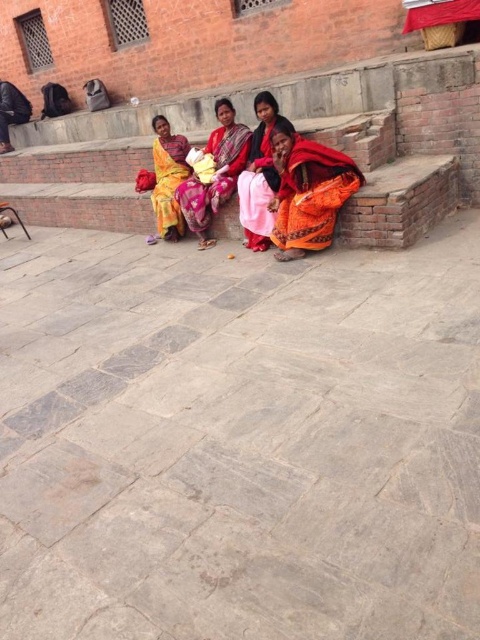
You are a photographer standing at the bottom of the stone steps where the women are sitting. You want to take a photo of the orange fabric sari at center and ensure that the entire sari is visible in the frame. The camera you are using has a minimum focus distance of 5 meters. Will you be able to capture the sari clearly?

The orange fabric sari at center is 5.71 meters away from you. Since the minimum focus distance of your camera is 5 meters, you can capture the orange fabric sari at center clearly as you are beyond the minimum required distance.

You are standing at the center of the stone steps and want to hand a gift to the person wearing the orange fabric sari at lower right. In which direction should you move to reach them?

The orange fabric sari at lower right is located at point 0.300 in the x coordinate and 0.642 in the y coordinate. Since you are at the center, you should move towards the lower right direction to reach them.